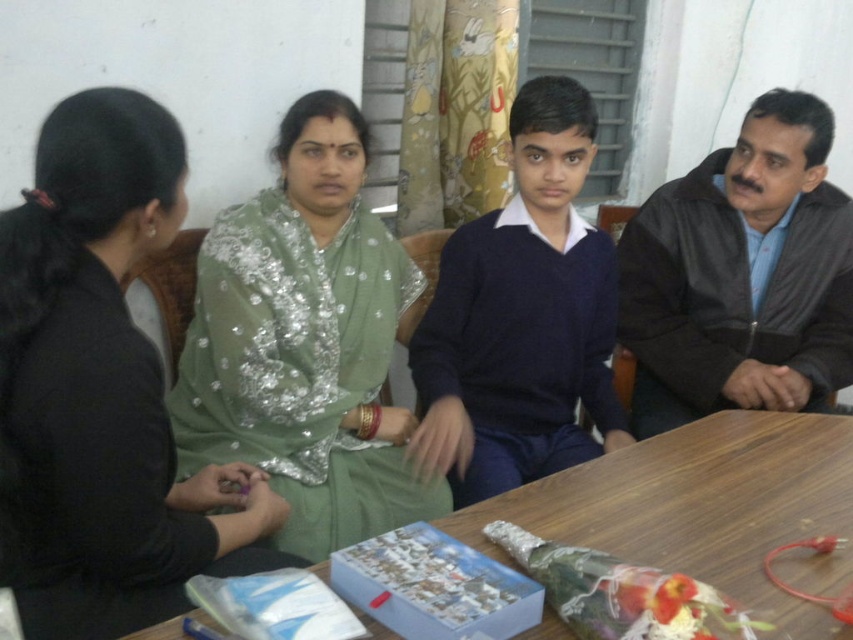
Does green sequined shawl at center appear over wooden table at center?

Yes, green sequined shawl at center is above wooden table at center.

Does green sequined shawl at center have a smaller size compared to wooden table at center?

No, green sequined shawl at center is not smaller than wooden table at center.

I want to click on green sequined shawl at center, so click(x=305, y=342).

Is green sequined shawl at center above dark brown leather jacket at right?

No.

Is green sequined shawl at center thinner than dark brown leather jacket at right?

Incorrect, green sequined shawl at center's width is not less than dark brown leather jacket at right's.

Is point (231, 324) farther from camera compared to point (840, 248)?

No, it is in front of (840, 248).

In order to click on green sequined shawl at center in this screenshot , I will do `click(305, 342)`.

Which is more to the left, matte green saree at center or green sequined shawl at center?

From the viewer's perspective, matte green saree at center appears more on the left side.

Who is positioned more to the right, matte green saree at center or green sequined shawl at center?

green sequined shawl at center is more to the right.

Who is more forward, [22,417] or [202,356]?

Point [22,417] is more forward.

The width and height of the screenshot is (853, 640). What are the coordinates of `matte green saree at center` in the screenshot? It's located at (102, 390).